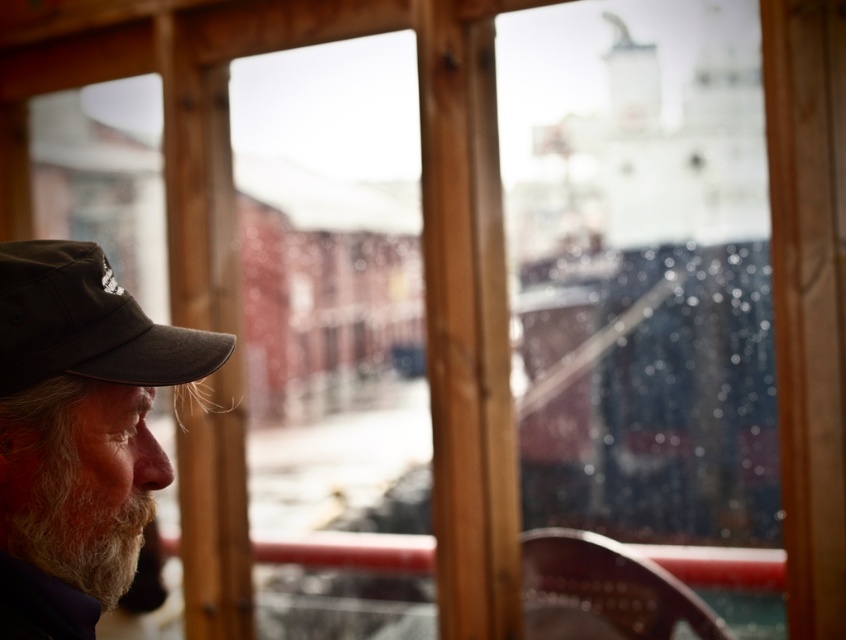
You are a tailor who needs to determine which cap requires more fabric to make between the gray fabric cap at left and the dark brown fabric baseball cap at lower left. Which one would need more fabric?

The gray fabric cap at left requires more fabric because it is larger in size than the dark brown fabric baseball cap at lower left.

You are a photographer trying to capture a closeup of the white fuzzy beard at lower left. You notice the dark brown fabric baseball cap at lower left is blocking your view. Can you move the cap to the side to get a clearer shot of the beard?

The dark brown fabric baseball cap at lower left is closer to the viewer than the white fuzzy beard at lower left, so moving the cap would allow the photographer to get a clearer shot of the beard.

You are an observer inside the cabin. You notice the gray fabric cap at left and the white fuzzy beard at lower left. Which object appears taller in the scene?

The gray fabric cap at left appears taller than the white fuzzy beard at lower left in the scene.